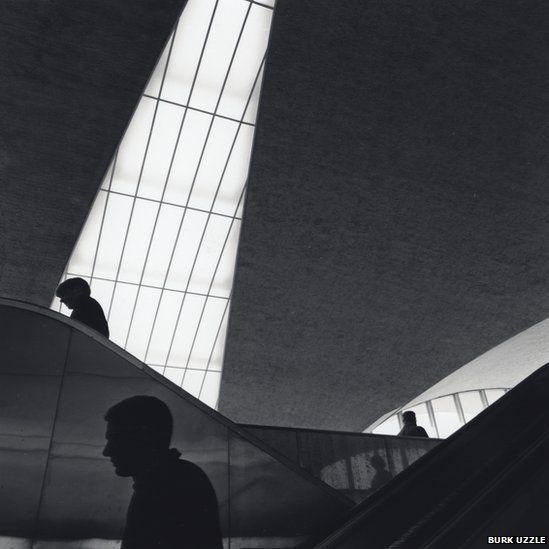
Where is `ceiling panel`? Image resolution: width=549 pixels, height=549 pixels. ceiling panel is located at coordinates (401, 268).